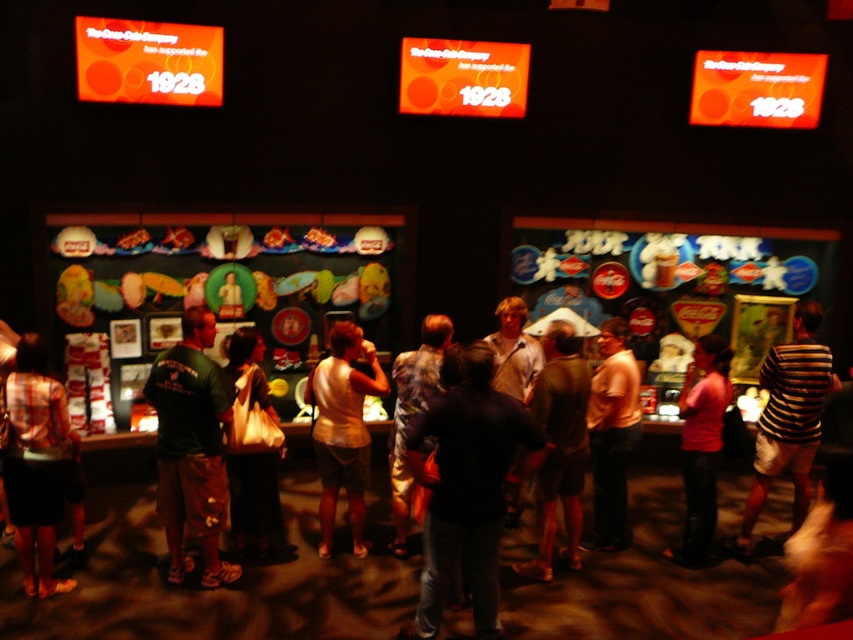
Consider the image. You are a photographer setting up for an event in this Coca Cola exhibit. You need to place a camera on the floor between the light beige tank top at center and the white fabric bag at center. Which object should you position the camera closer to if you want it to be near the narrower item?

The white fabric bag at center is narrower than the light beige tank top at center. Position the camera closer to the white fabric bag at center to be near the narrower item.

You are a photographer at the Coca Cola exhibit and need to capture a photo that includes both the dark blue shirt at center and the matte black skirt at lower left. Based on their positions, which object should you ensure is placed to the right in your frame?

The dark blue shirt at center is positioned on the right side of the matte black skirt at lower left, so in your frame, the dark blue shirt at center should be placed to the right of the matte black skirt at lower left.